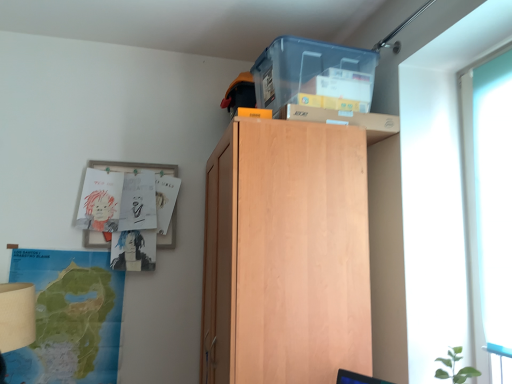
Question: Is transparent glass door at right inside or outside of green paper map at lower left?

Choices:
 (A) inside
 (B) outside

Answer: (B)

Question: From a real-world perspective, is transparent glass door at right above or below green paper map at lower left?

Choices:
 (A) below
 (B) above

Answer: (B)

Question: Estimate the real-world distances between objects in this image. Which object is farther from the transparent glass door at right?

Choices:
 (A) light wood cabinet at upper center
 (B) green paper map at lower left
 (C) transparent plastic storage box at upper center

Answer: (B)

Question: Estimate the real-world distances between objects in this image. Which object is farther from the light wood cabinet at upper center?

Choices:
 (A) transparent glass door at right
 (B) transparent plastic storage box at upper center
 (C) green paper map at lower left

Answer: (C)